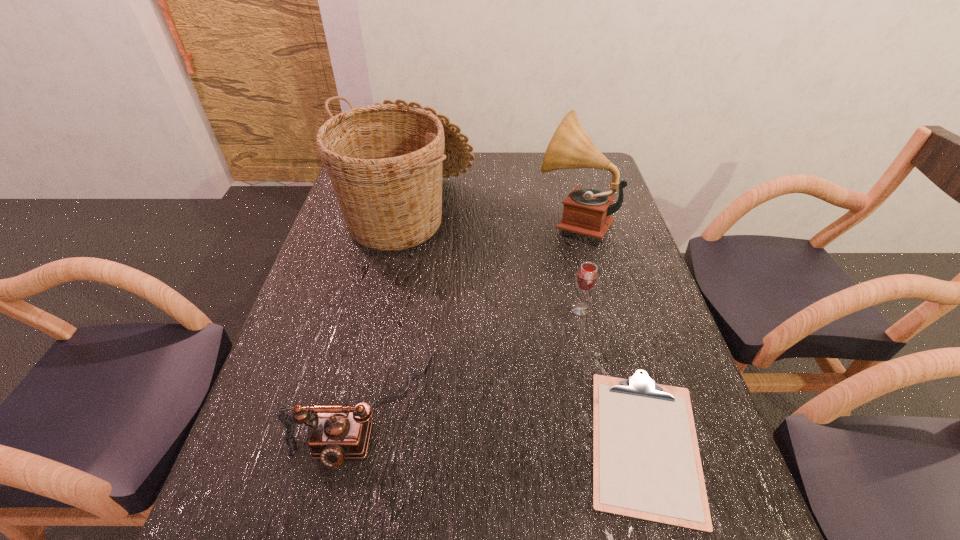
Where is `blank space at the far edge`? The height and width of the screenshot is (540, 960). blank space at the far edge is located at coordinates (484, 168).

Where is `free space at the left edge of the desktop`? This screenshot has height=540, width=960. free space at the left edge of the desktop is located at coordinates click(323, 303).

In the image, there is a desktop. Identify the location of blank space at the right edge. (662, 316).

This screenshot has height=540, width=960. What are the coordinates of `vacant area that lies between the basket and the telephone` in the screenshot? It's located at (386, 310).

Identify the location of free space that is in between the phonograph record and the telephone. (469, 313).

Where is `free space between the clipboard and the telephone`? The height and width of the screenshot is (540, 960). free space between the clipboard and the telephone is located at coordinates (505, 424).

Locate an element on the screen. The width and height of the screenshot is (960, 540). free point between the phonograph record and the wineglass is located at coordinates (577, 265).

The image size is (960, 540). I want to click on free space that is in between the clipboard and the telephone, so click(x=505, y=424).

Find the location of a particular element. The image size is (960, 540). free space that is in between the telephone and the shortest object is located at coordinates (505, 424).

Find the location of a particular element. This screenshot has height=540, width=960. empty space between the telephone and the phonograph record is located at coordinates (469, 313).